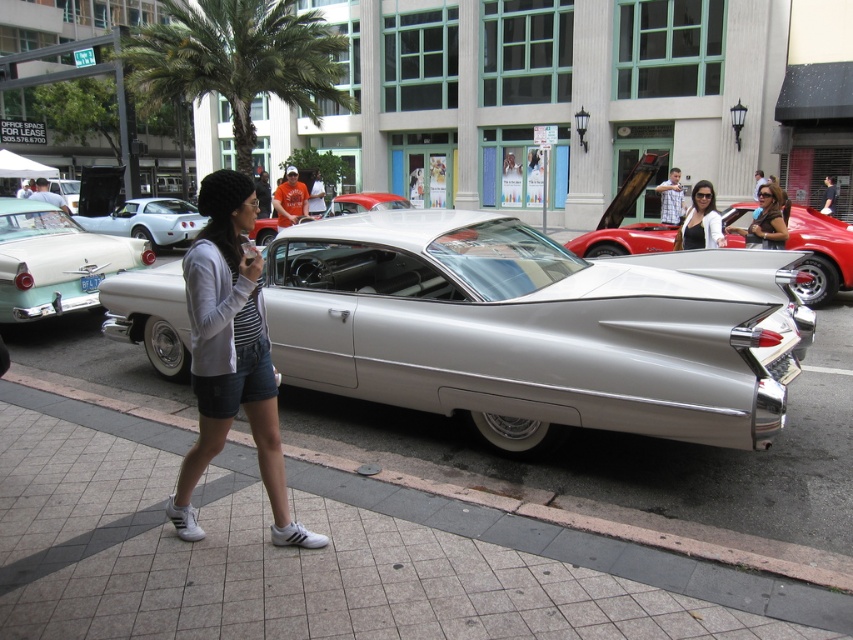
Who is more forward, (x=468, y=387) or (x=718, y=237)?

Point (x=468, y=387) is in front.

Locate an element on the screen. This screenshot has height=640, width=853. silver metallic car at center is located at coordinates (x=534, y=326).

Does point (183, 314) come farther from viewer compared to point (708, 234)?

That is False.

You are a GUI agent. You are given a task and a screenshot of the screen. Output one action in this format:
    pyautogui.click(x=<x>, y=<y>)
    Task: Click on the silver metallic car at center
    The width and height of the screenshot is (853, 640).
    Given the screenshot: What is the action you would take?
    pyautogui.click(x=534, y=326)

Based on the photo, measure the distance between silver metallic car at center and shiny white car at center.

They are 17.85 meters apart.

Is silver metallic car at center shorter than shiny white car at center?

In fact, silver metallic car at center may be taller than shiny white car at center.

Between point (706, 328) and point (152, 225), which one is positioned in front?

Point (706, 328)

This screenshot has width=853, height=640. I want to click on silver metallic car at center, so click(534, 326).

Who is higher up, green leafy palm tree at upper center or shiny white car at center?

green leafy palm tree at upper center is above.

Between green leafy palm tree at upper center and shiny white car at center, which one has more height?

green leafy palm tree at upper center

I want to click on green leafy palm tree at upper center, so click(238, 60).